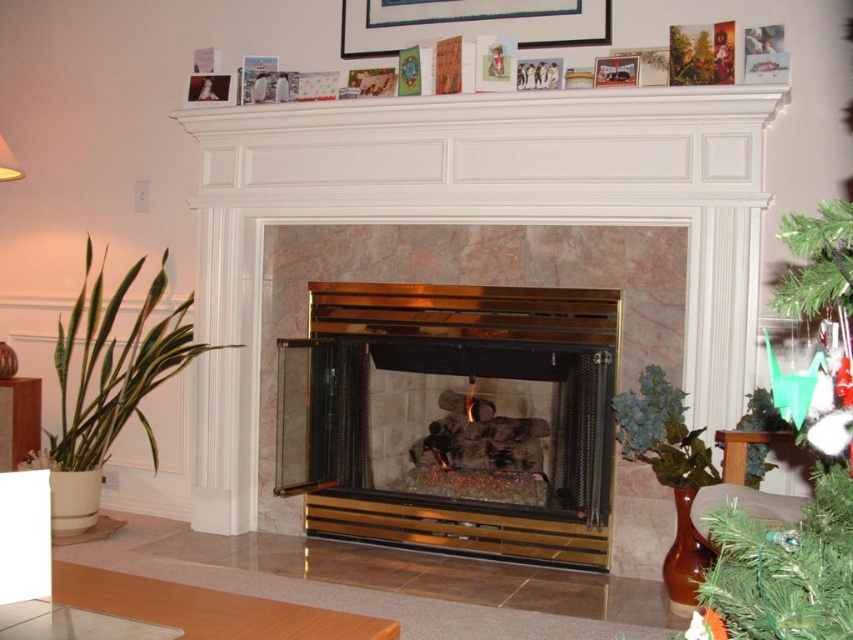
Question: Can you confirm if gold metallic fireplace at center is bigger than matte gold lampshade at upper left?

Choices:
 (A) no
 (B) yes

Answer: (B)

Question: Which point is closer to the camera?

Choices:
 (A) (605, 22)
 (B) (599, 355)

Answer: (B)

Question: Can you confirm if metallic silver picture frame at upper center is wider than metallic photo frame at upper center?

Choices:
 (A) no
 (B) yes

Answer: (A)

Question: Which point is closer to the camera?

Choices:
 (A) metallic silver picture frame at upper center
 (B) wooden picture frame at upper center
 (C) gold metallic fireplace at center
 (D) metallic photo frame at upper center

Answer: (A)

Question: Estimate the real-world distances between objects in this image. Which object is closer to the matte gold lampshade at upper left?

Choices:
 (A) wooden picture frame at upper center
 (B) metallic silver picture frame at upper center

Answer: (A)

Question: Is gold metallic fireplace at center behind matte gold lampshade at upper left?

Choices:
 (A) no
 (B) yes

Answer: (A)